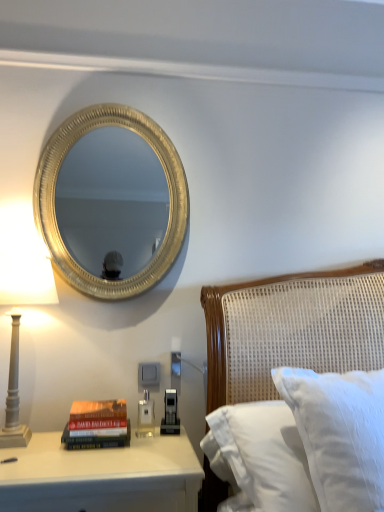
Locate an element on the screen. blank space above gold textured mirror at upper left (from a real-world perspective) is located at coordinates (120, 102).